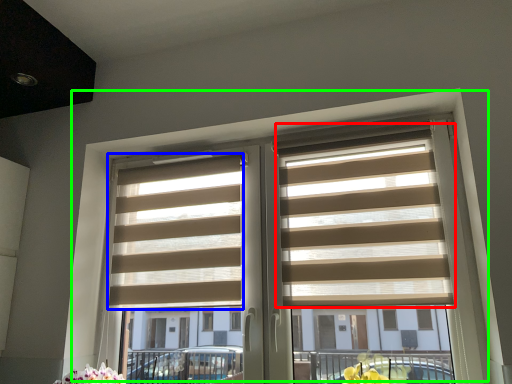
Question: Which object is the closest to the blind (highlighted by a red box)? Choose among these: blind (highlighted by a blue box) or window (highlighted by a green box).

Choices:
 (A) blind
 (B) window

Answer: (B)